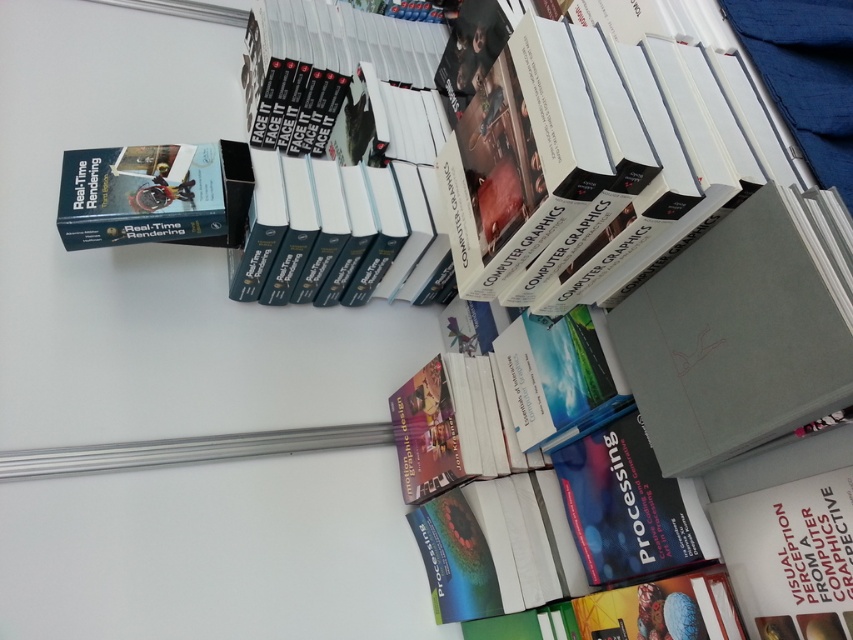
Question: Is gray matte book at center-right positioned at the back of hardcover book at upper left?

Choices:
 (A) no
 (B) yes

Answer: (A)

Question: Does gray matte book at center-right have a larger size compared to hardcover book at upper left?

Choices:
 (A) no
 (B) yes

Answer: (B)

Question: Which point appears closest to the camera in this image?

Choices:
 (A) (680, 362)
 (B) (80, 150)

Answer: (A)

Question: Does gray matte book at center-right appear on the right side of hardcover book at upper left?

Choices:
 (A) yes
 (B) no

Answer: (A)

Question: Which of the following is the closest to the observer?

Choices:
 (A) (155, 164)
 (B) (738, 307)

Answer: (B)